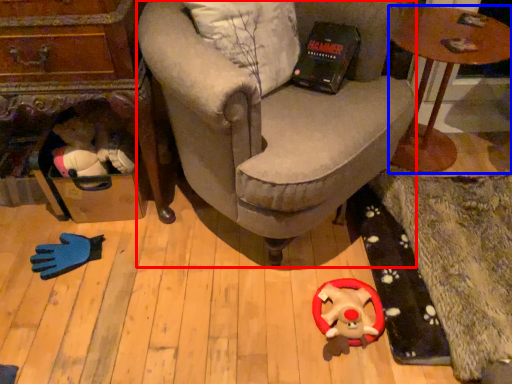
Question: Among these objects, which one is farthest to the camera, chair (highlighted by a red box) or table (highlighted by a blue box)?

Choices:
 (A) chair
 (B) table

Answer: (B)